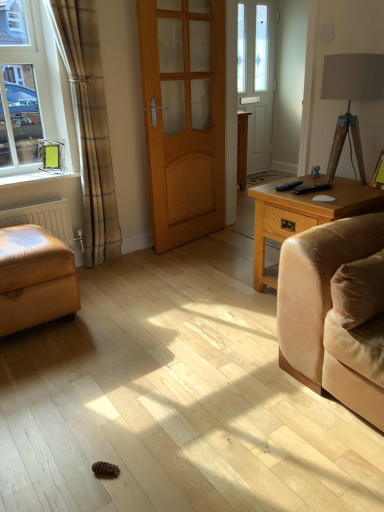
The height and width of the screenshot is (512, 384). What are the coordinates of `vacant space that is in between leather armchair at left and wooden door at center` in the screenshot? It's located at (146, 269).